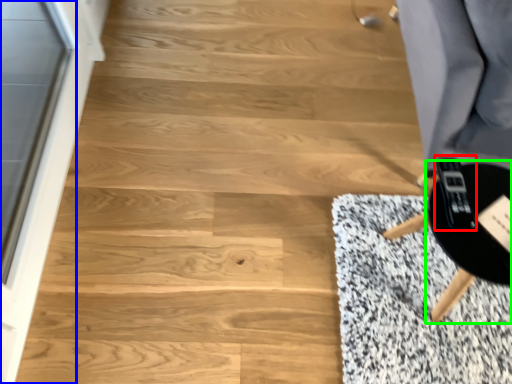
Question: Considering the real-world distances, which object is farthest from game controller (highlighted by a red box)? screen door (highlighted by a blue box) or round table (highlighted by a green box)?

Choices:
 (A) screen door
 (B) round table

Answer: (A)